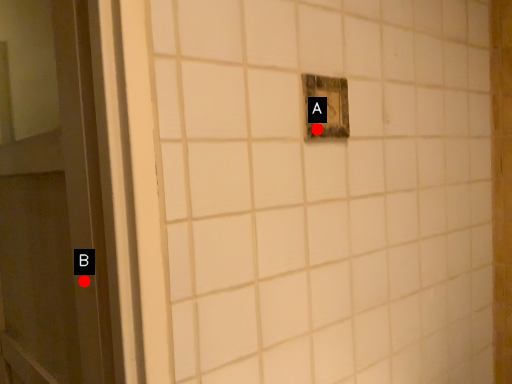
Question: Two points are circled on the image, labeled by A and B beside each circle. Which point appears farthest from the camera in this image?

Choices:
 (A) A is further
 (B) B is further

Answer: (A)